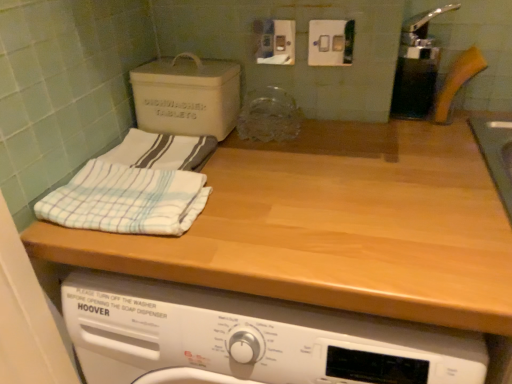
Identify the location of blank space above wooden at upper center (from a real-world perspective). pyautogui.click(x=327, y=167).